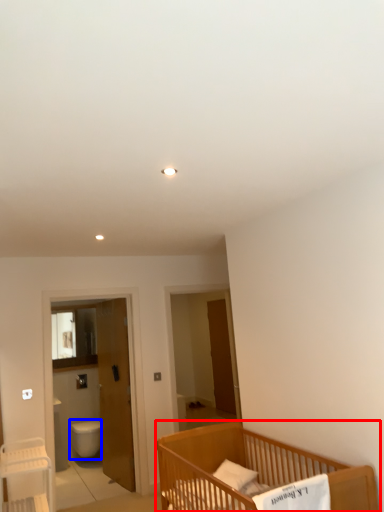
Question: Which point is closer to the camera, infant bed (highlighted by a red box) or toilet bowl (highlighted by a blue box)?

Choices:
 (A) infant bed
 (B) toilet bowl

Answer: (A)